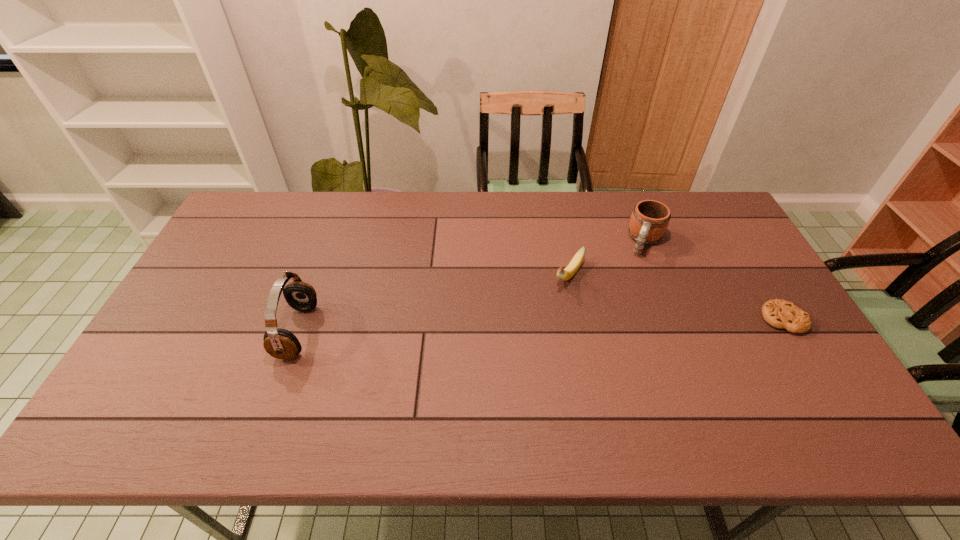
What are the coordinates of `vacant spot on the desktop that is between the headset and the shortest object and is positioned on the side of the mug with the handle` in the screenshot? It's located at (613, 323).

Where is `vacant spot on the desktop that is between the tallest object and the rightmost object and is positioned at the stem of the third tallest object`? Image resolution: width=960 pixels, height=540 pixels. vacant spot on the desktop that is between the tallest object and the rightmost object and is positioned at the stem of the third tallest object is located at coordinates (530, 326).